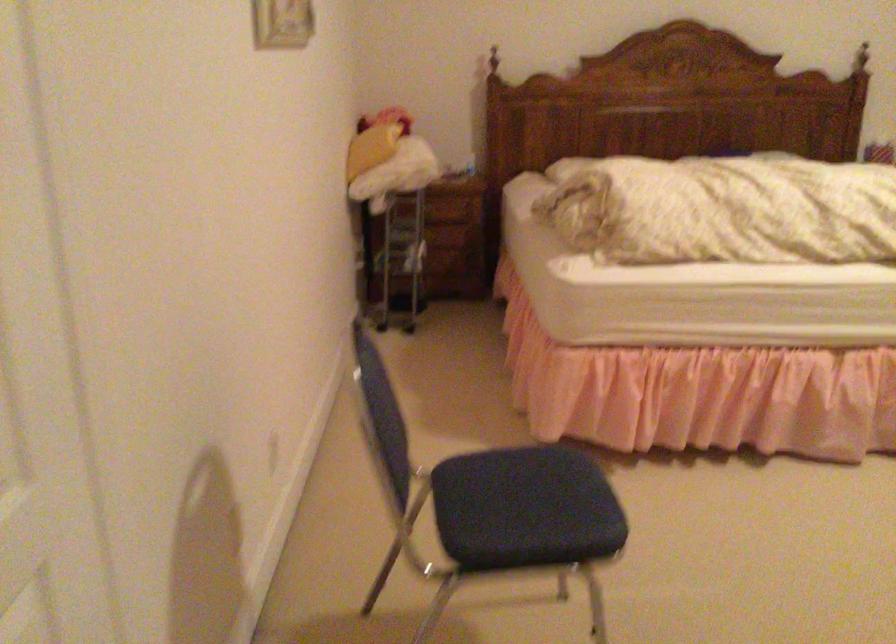
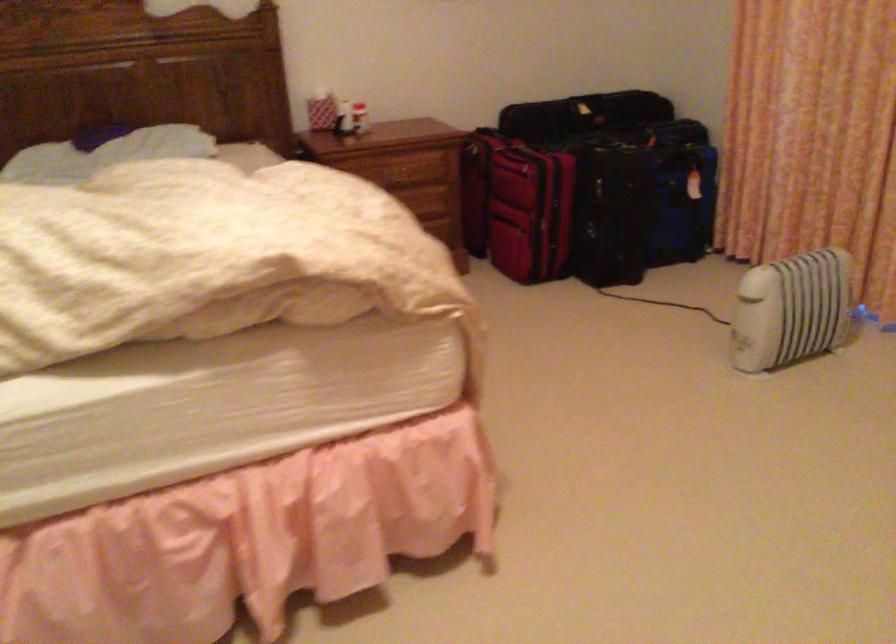
In a continuous first-person perspective shot, in which direction is the camera moving?

The cameraman walked toward right, forward.